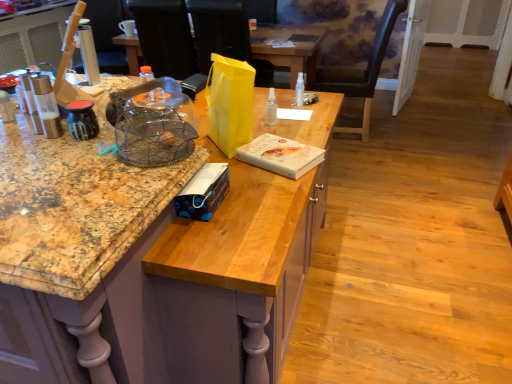
I want to click on free space to the left of wire mesh birdcage at center, so click(59, 163).